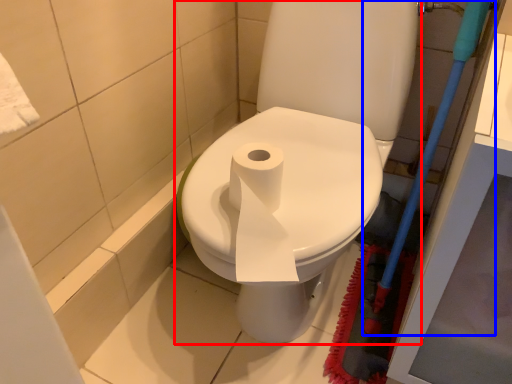
Question: Which point is closer to the camera, toilet (highlighted by a red box) or brush (highlighted by a blue box)?

Choices:
 (A) toilet
 (B) brush

Answer: (B)